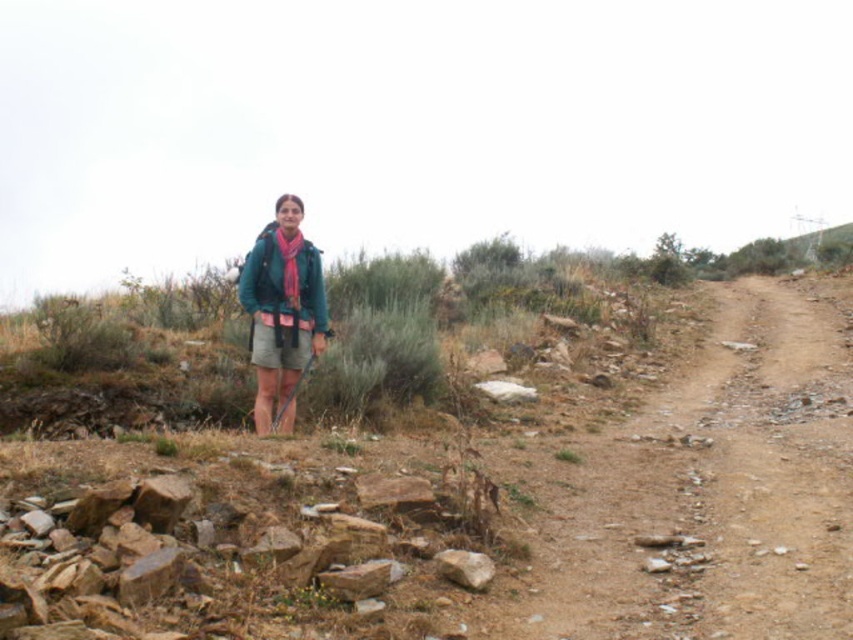
Based on the photo, is teal fabric jacket at center behind gray fabric skirt at center?

No, it is in front of gray fabric skirt at center.

Is teal fabric jacket at center positioned in front of gray fabric skirt at center?

Yes, it is in front of gray fabric skirt at center.

Image resolution: width=853 pixels, height=640 pixels. What are the coordinates of `teal fabric jacket at center` in the screenshot? It's located at (282, 312).

Is point (288, 230) farther from viewer compared to point (288, 307)?

Yes, point (288, 230) is farther from viewer.

Does point (315, 253) lie in front of point (300, 289)?

No, it is not.

At what (x,y) coordinates should I click in order to perform the action: click on teal fabric jacket at center. Please return your answer as a coordinate pair (x, y). The height and width of the screenshot is (640, 853). Looking at the image, I should click on (282, 312).

Is teal matte jacket at center positioned at the back of gray fabric skirt at center?

Yes, teal matte jacket at center is further from the viewer.

Is point (322, 323) in front of point (274, 348)?

No.

This screenshot has width=853, height=640. What do you see at coordinates (283, 284) in the screenshot?
I see `teal matte jacket at center` at bounding box center [283, 284].

Locate an element on the screen. This screenshot has height=640, width=853. teal matte jacket at center is located at coordinates (283, 284).